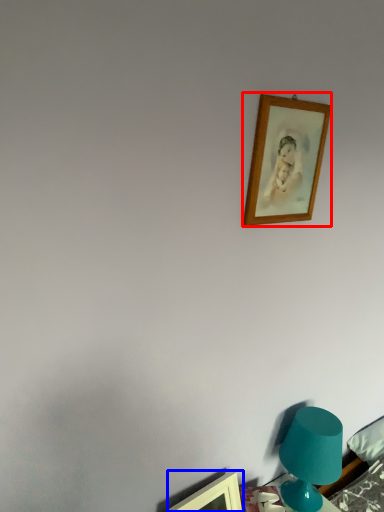
Question: Among these objects, which one is nearest to the camera, picture frame (highlighted by a red box) or picture frame (highlighted by a blue box)?

Choices:
 (A) picture frame
 (B) picture frame

Answer: (A)